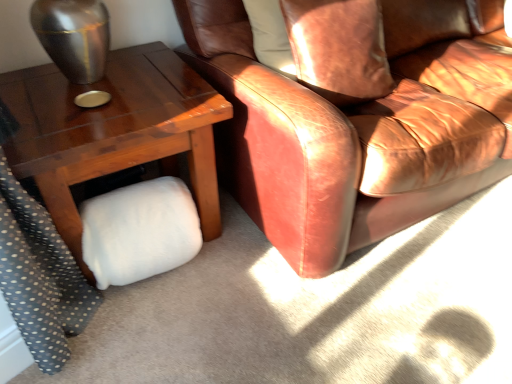
Find the location of a particular element. This screenshot has height=384, width=512. vacant space in front of white fluffy pillow at lower left is located at coordinates [146, 331].